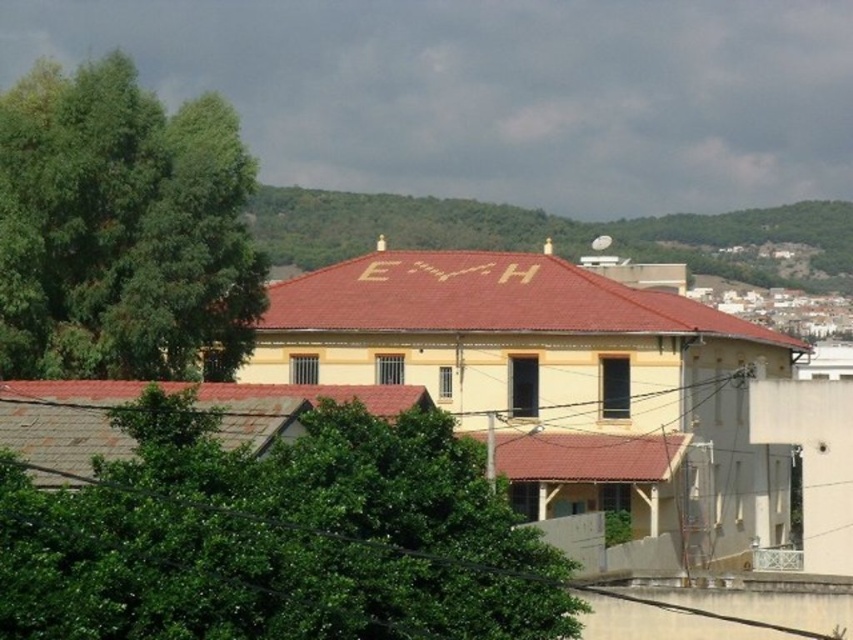
Question: Which object is the closest to the green leafy hillside at upper center?

Choices:
 (A) green leafy tree at left
 (B) green leafy tree at lower left

Answer: (A)

Question: Which point appears farthest from the camera in this image?

Choices:
 (A) (44, 221)
 (B) (376, 429)
 (C) (840, 259)

Answer: (C)

Question: Is green leafy tree at lower left behind green leafy hillside at upper center?

Choices:
 (A) no
 (B) yes

Answer: (A)

Question: Is green leafy tree at lower left above green leafy tree at left?

Choices:
 (A) yes
 (B) no

Answer: (B)

Question: Is green leafy tree at left bigger than green leafy hillside at upper center?

Choices:
 (A) yes
 (B) no

Answer: (B)

Question: Which point is farther from the camera taking this photo?

Choices:
 (A) pos(428,582)
 (B) pos(360,195)
 (C) pos(263,291)

Answer: (B)